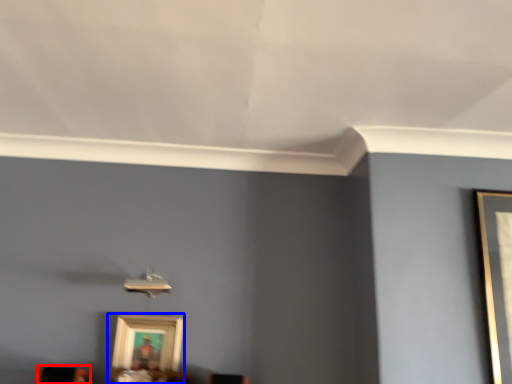
Question: Which of the following is the closest to the observer, furniture (highlighted by a red box) or picture frame (highlighted by a blue box)?

Choices:
 (A) furniture
 (B) picture frame

Answer: (A)